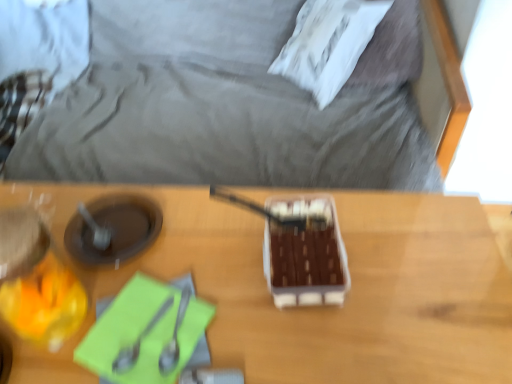
Where is `empty space that is in between green matte notepad at lower left and brown matte chocolate bar at center`? The image size is (512, 384). empty space that is in between green matte notepad at lower left and brown matte chocolate bar at center is located at coordinates (240, 286).